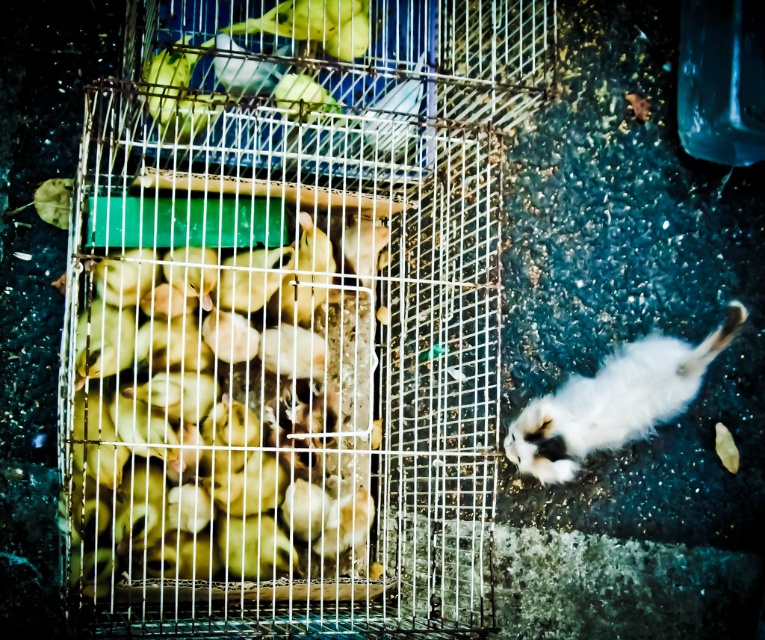
Question: Can you confirm if yellow matte chicks at center is smaller than white fluffy cat at lower right?

Choices:
 (A) yes
 (B) no

Answer: (B)

Question: Which of the following is the closest to the observer?

Choices:
 (A) (409, 579)
 (B) (148, 449)
 (C) (573, 465)

Answer: (B)

Question: Which of the following is the closest to the observer?

Choices:
 (A) (220, 326)
 (B) (93, 538)
 (C) (705, 364)

Answer: (B)

Question: Which of the following is the farthest from the observer?

Choices:
 (A) (145, 540)
 (B) (405, 358)
 (C) (656, 403)

Answer: (B)

Question: In this image, where is yellow matte chicks at center located relative to white fluffy cat at lower right?

Choices:
 (A) above
 (B) below

Answer: (A)

Question: Does yellow matte chicks at center have a greater width compared to white fluffy cat at lower right?

Choices:
 (A) yes
 (B) no

Answer: (B)